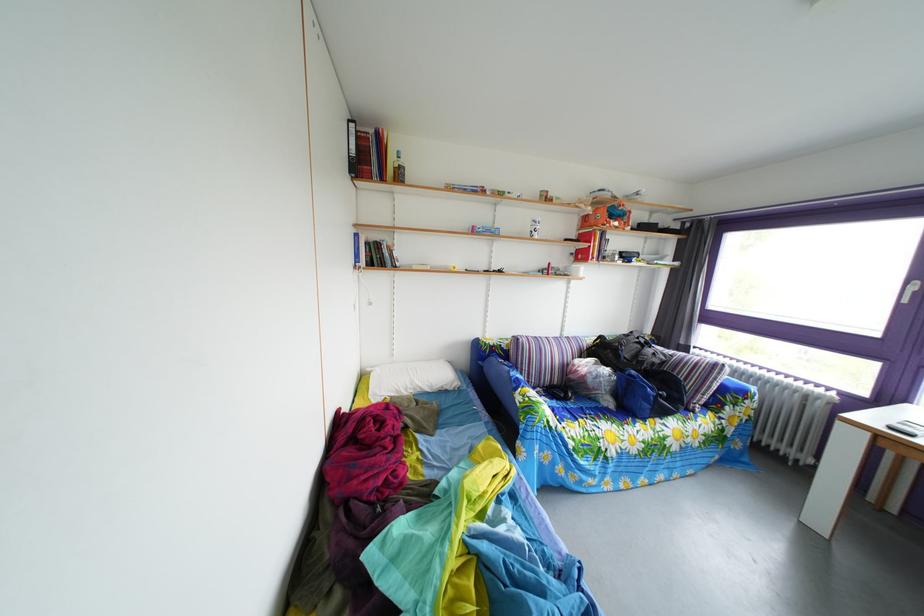
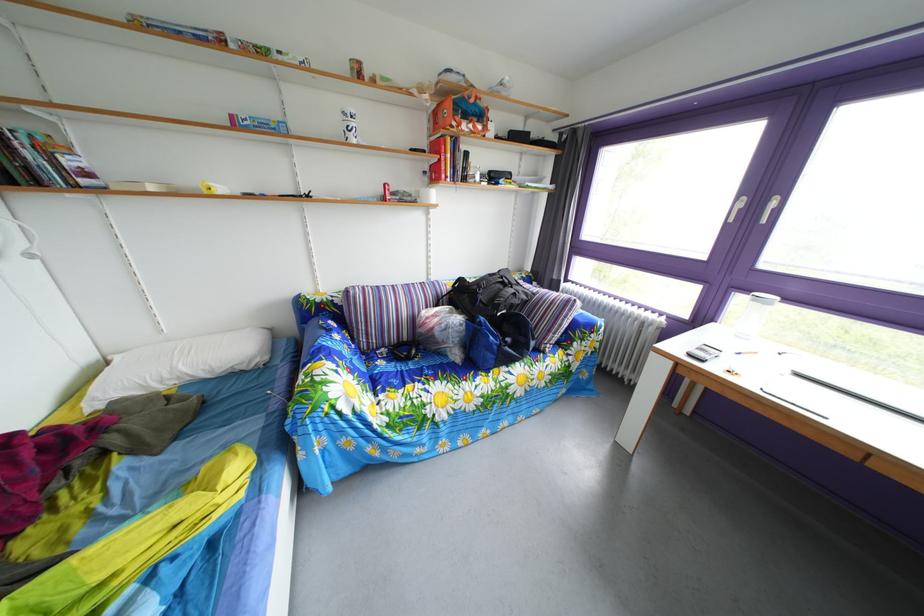
In a continuous first-person perspective shot, in which direction is the camera moving?

The movement direction of the cameraman is right, forward.